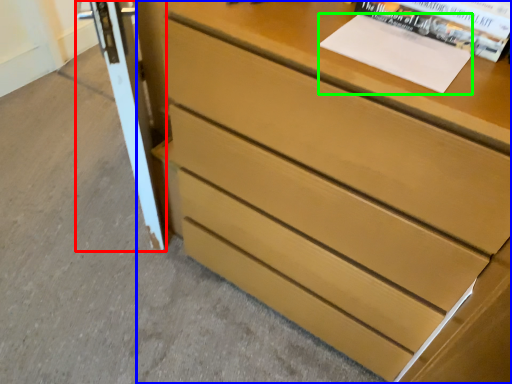
Question: Estimate the real-world distances between objects in this image. Which object is farther from screen door (highlighted by a red box), chest of drawers (highlighted by a blue box) or paperback book (highlighted by a green box)?

Choices:
 (A) chest of drawers
 (B) paperback book

Answer: (B)